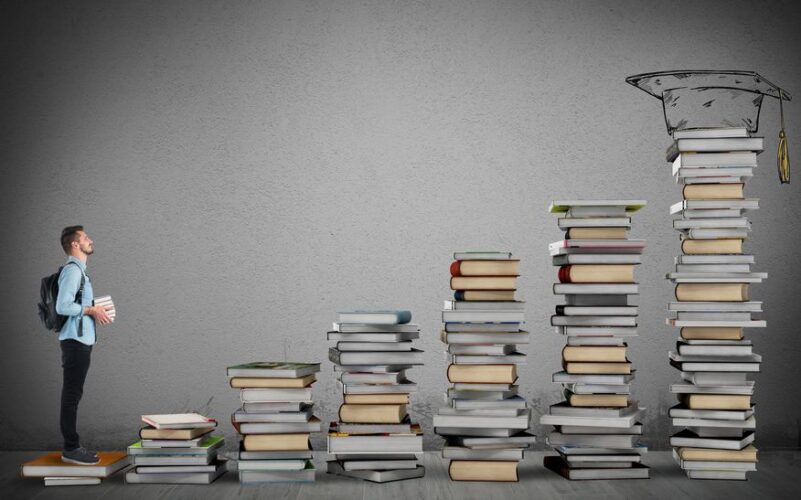
Locate an element on the screen. This screenshot has width=801, height=500. books in 2nd stack from the left is located at coordinates (172, 417), (160, 434), (172, 442), (174, 450), (174, 459), (183, 468), (180, 474).